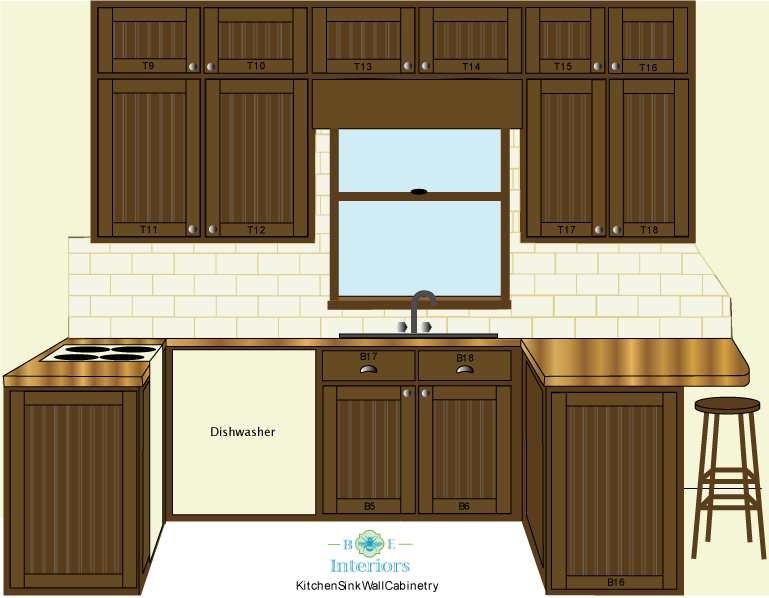
Identify the location of bunner plates of the stove. (85, 347), (137, 347), (122, 355), (80, 355).